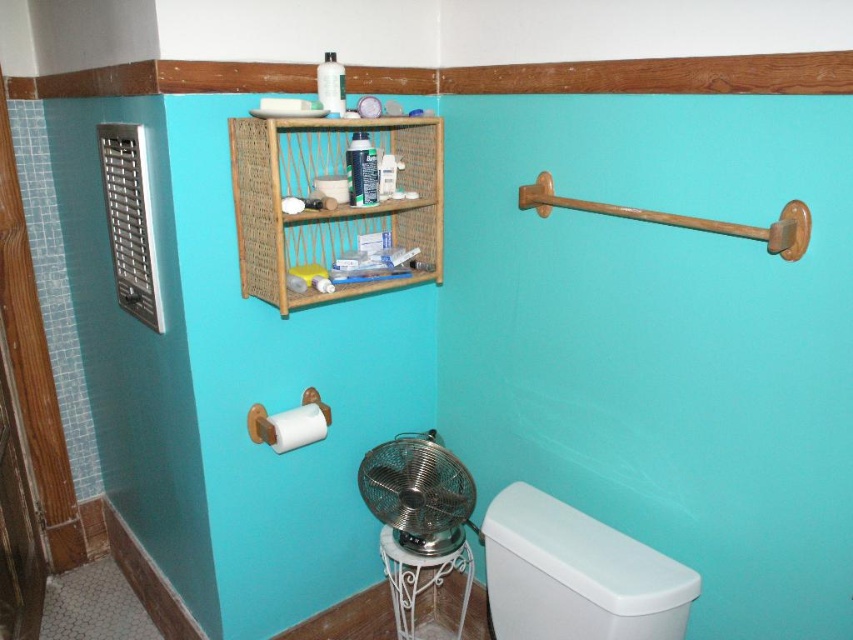
Question: Among these objects, which one is nearest to the camera?

Choices:
 (A) wooden towel bar at right
 (B) white matte toilet paper at lower left
 (C) metallic silver stool at lower center
 (D) woven bamboo shelf at upper center

Answer: (A)

Question: Is metallic silver fan at lower center closer to camera compared to wooden towel bar at right?

Choices:
 (A) yes
 (B) no

Answer: (B)

Question: Can you confirm if metallic silver fan at lower center is wider than wooden towel bar at right?

Choices:
 (A) no
 (B) yes

Answer: (A)

Question: Which point is closer to the camera?

Choices:
 (A) (415, 627)
 (B) (415, 536)

Answer: (B)

Question: Is woven bamboo shelf at upper center above metallic silver stool at lower center?

Choices:
 (A) yes
 (B) no

Answer: (A)

Question: Based on their relative distances, which object is farther from the wooden towel bar at right?

Choices:
 (A) white matte toilet paper at lower left
 (B) woven bamboo shelf at upper center
 (C) white plastic toilet at lower right

Answer: (A)